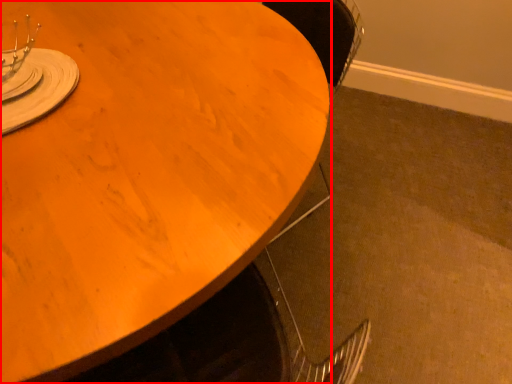
Question: From the image's perspective, what is the correct spatial relationship of table (annotated by the red box) in relation to tableware?

Choices:
 (A) below
 (B) above

Answer: (A)